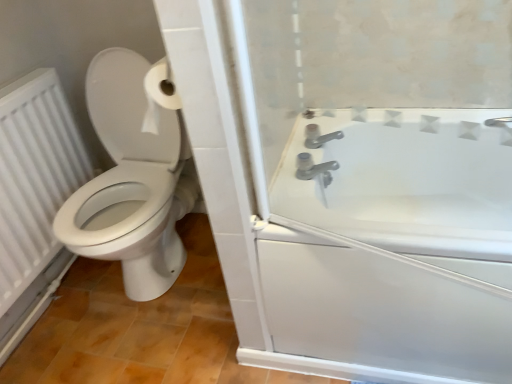
Question: Is white textured radiator at left taller than satin nickel faucet at upper right?

Choices:
 (A) no
 (B) yes

Answer: (B)

Question: Is white textured radiator at left positioned behind satin nickel faucet at upper right?

Choices:
 (A) yes
 (B) no

Answer: (B)

Question: Is white textured radiator at left positioned with its back to satin nickel faucet at upper right?

Choices:
 (A) yes
 (B) no

Answer: (B)

Question: Can you confirm if white textured radiator at left is smaller than satin nickel faucet at upper right?

Choices:
 (A) no
 (B) yes

Answer: (A)

Question: From a real-world perspective, is white textured radiator at left physically above satin nickel faucet at upper right?

Choices:
 (A) no
 (B) yes

Answer: (A)

Question: Based on their sizes in the image, would you say satin nickel faucet at upper right is bigger or smaller than white textured radiator at left?

Choices:
 (A) small
 (B) big

Answer: (A)

Question: Looking at their shapes, would you say satin nickel faucet at upper right is wider or thinner than white textured radiator at left?

Choices:
 (A) thin
 (B) wide

Answer: (B)

Question: Is satin nickel faucet at upper right situated inside white textured radiator at left or outside?

Choices:
 (A) inside
 (B) outside

Answer: (B)

Question: Is point (322, 167) positioned closer to the camera than point (72, 192)?

Choices:
 (A) farther
 (B) closer

Answer: (B)

Question: Based on their sizes in the image, would you say white textured radiator at left is bigger or smaller than satin nickel faucet at upper right?

Choices:
 (A) small
 (B) big

Answer: (B)

Question: Is white textured radiator at left in front of or behind satin nickel faucet at upper right in the image?

Choices:
 (A) behind
 (B) front

Answer: (B)

Question: Is point [x=12, y=157] positioned closer to the camera than point [x=317, y=168]?

Choices:
 (A) closer
 (B) farther

Answer: (B)

Question: In terms of height, does white textured radiator at left look taller or shorter compared to satin nickel faucet at upper right?

Choices:
 (A) tall
 (B) short

Answer: (A)

Question: Is white textured radiator at left inside the boundaries of white glossy bathtub at right, or outside?

Choices:
 (A) outside
 (B) inside

Answer: (A)

Question: Based on their sizes in the image, would you say white textured radiator at left is bigger or smaller than white glossy bathtub at right?

Choices:
 (A) big
 (B) small

Answer: (B)